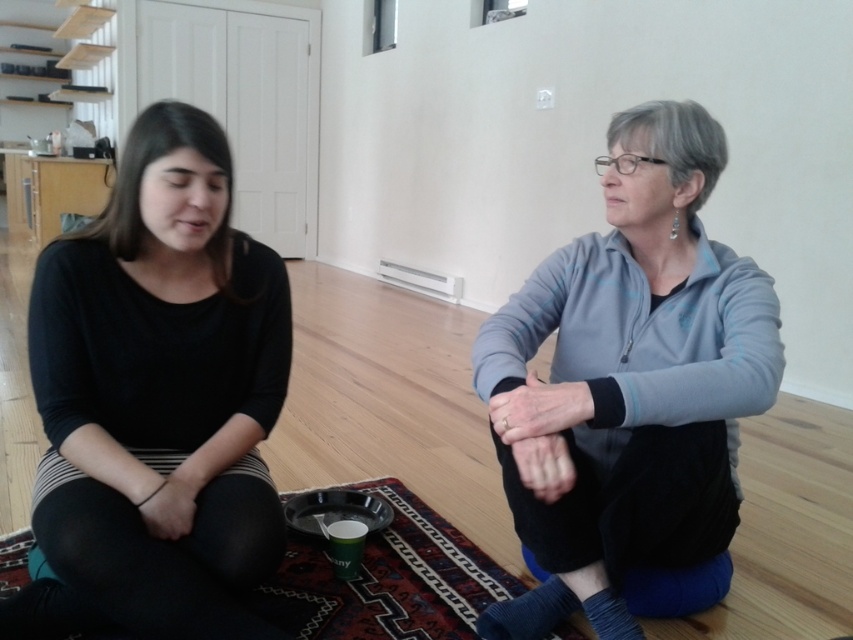
Does black matte shirt at left have a larger size compared to carpeted mat at center?

Yes.

Can you confirm if black matte shirt at left is positioned below carpeted mat at center?

No, black matte shirt at left is not below carpeted mat at center.

Measure the distance between black matte shirt at left and camera.

A distance of 1.10 meters exists between black matte shirt at left and camera.

You are a GUI agent. You are given a task and a screenshot of the screen. Output one action in this format:
    pyautogui.click(x=<x>, y=<y>)
    Task: Click on the black matte shirt at left
    The image size is (853, 640).
    Given the screenshot: What is the action you would take?
    pyautogui.click(x=158, y=400)

Is point (181, 385) behind point (596, 474)?

No, it is in front of (596, 474).

Can you confirm if black matte shirt at left is positioned above gray fleece jacket at center?

Yes.

Is point (231, 180) less distant than point (613, 468)?

That is False.

You are a GUI agent. You are given a task and a screenshot of the screen. Output one action in this format:
    pyautogui.click(x=<x>, y=<y>)
    Task: Click on the black matte shirt at left
    
    Given the screenshot: What is the action you would take?
    pyautogui.click(x=158, y=400)

Does gray fleece jacket at center have a smaller size compared to carpeted mat at center?

No, gray fleece jacket at center is not smaller than carpeted mat at center.

Does point (611, 564) lie in front of point (428, 596)?

Yes.

Find the location of a particular element. The image size is (853, 640). gray fleece jacket at center is located at coordinates (628, 380).